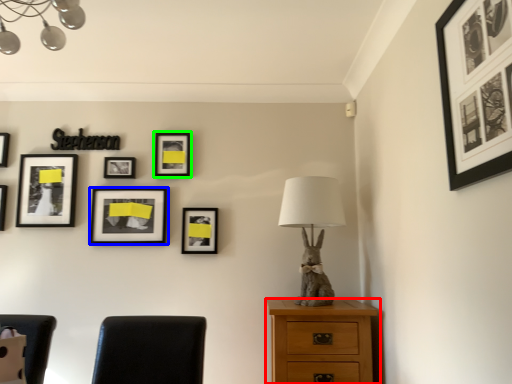
Question: Estimate the real-world distances between objects in this image. Which object is farther from chest of drawers (highlighted by a red box), picture frame (highlighted by a blue box) or picture frame (highlighted by a green box)?

Choices:
 (A) picture frame
 (B) picture frame

Answer: (B)